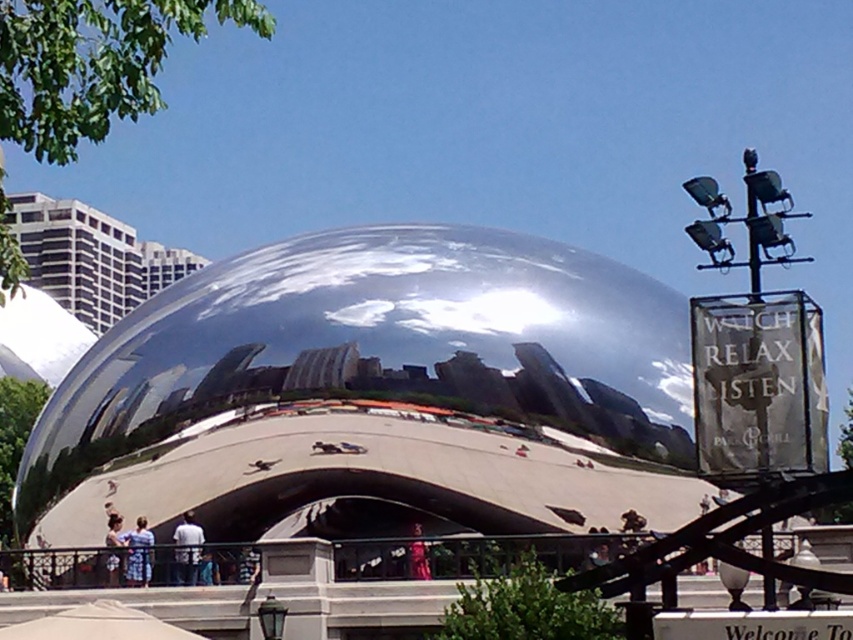
Question: Which point is closer to the camera?

Choices:
 (A) matte pink dress at center
 (B) blue denim jeans at lower center
 (C) blue denim jeans at lower left
 (D) light blue jeans at lower center

Answer: (A)

Question: Which point appears farthest from the camera in this image?

Choices:
 (A) (114, 552)
 (B) (192, 540)
 (C) (416, 529)

Answer: (C)

Question: Among these points, which one is farthest from the camera?

Choices:
 (A) (135, 550)
 (B) (413, 563)
 (C) (189, 576)

Answer: (A)

Question: Can you confirm if light blue jeans at lower center is positioned to the left of blue denim jeans at lower left?

Choices:
 (A) yes
 (B) no

Answer: (B)

Question: Can you confirm if blue denim jeans at lower center is bigger than matte pink dress at center?

Choices:
 (A) no
 (B) yes

Answer: (B)

Question: Is blue denim jeans at lower center to the left of matte pink dress at center from the viewer's perspective?

Choices:
 (A) yes
 (B) no

Answer: (A)